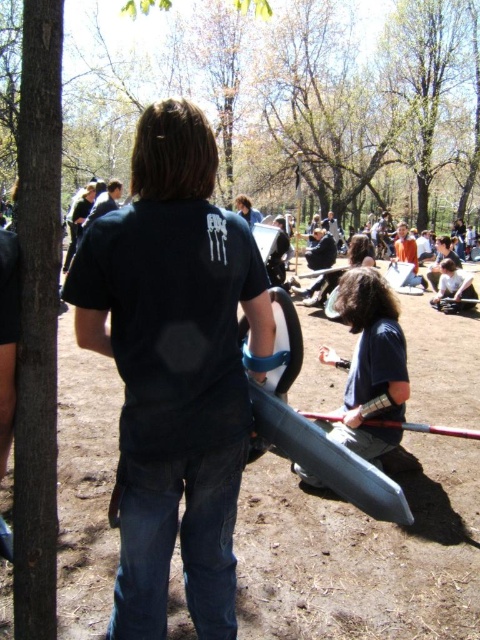
Question: Among these points, which one is farthest from the camera?

Choices:
 (A) (445, 60)
 (B) (128, 540)
 (C) (360, 312)
 (D) (432, 188)

Answer: (D)

Question: Is brown dirt field at center wider than green leafy tree at upper center?

Choices:
 (A) yes
 (B) no

Answer: (B)

Question: Among these points, which one is nearest to the camera?

Choices:
 (A) (372, 276)
 (B) (62, 602)

Answer: (B)

Question: Is black matte shirt at center further to camera compared to green leafy tree at upper center?

Choices:
 (A) no
 (B) yes

Answer: (A)

Question: Which point is closer to the camera?

Choices:
 (A) brown dirt field at center
 (B) matte black shirt at center
 (C) brown bark tree at upper center
 (D) green leafy tree at upper center

Answer: (C)

Question: Can you confirm if brown bark tree at upper center is positioned below black matte shirt at center?

Choices:
 (A) yes
 (B) no

Answer: (B)